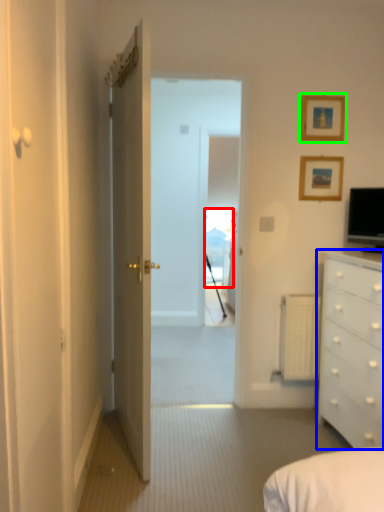
Question: Which object is positioned closest to window (highlighted by a red box)? Select from chest of drawers (highlighted by a blue box) and picture frame (highlighted by a green box).

Choices:
 (A) chest of drawers
 (B) picture frame

Answer: (B)